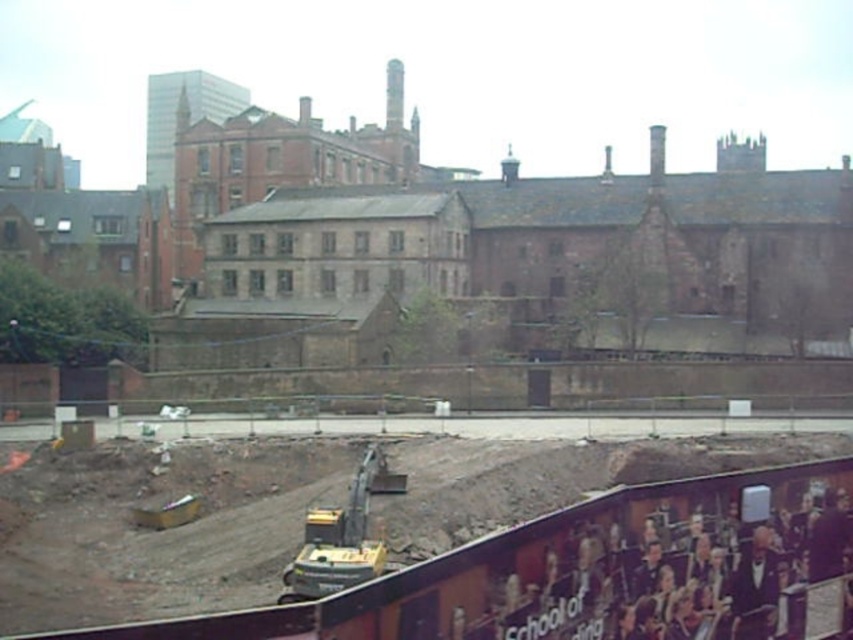
Does brown dirt track at lower center come in front of yellow metallic excavator at center?

That is True.

Between brown dirt track at lower center and yellow metallic excavator at center, which one is positioned higher?

brown dirt track at lower center is above.

Who is more distant from viewer, (254,618) or (309,564)?

Point (309,564)

The image size is (853, 640). I want to click on brown dirt track at lower center, so click(x=596, y=566).